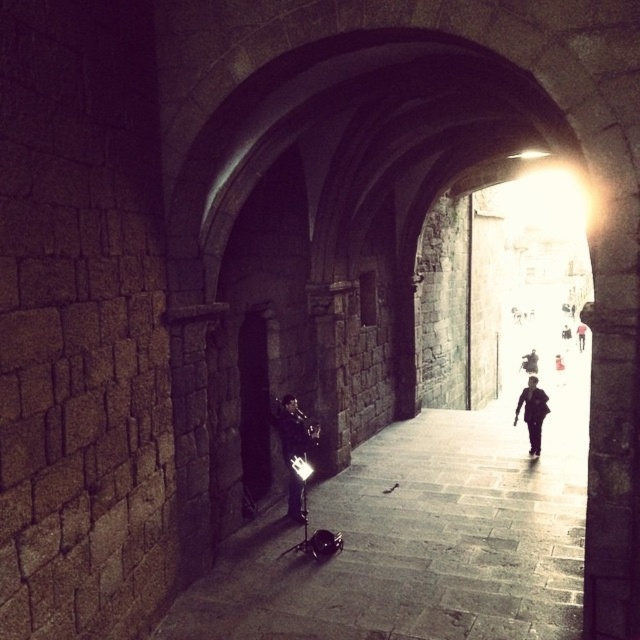
Based on the photo, you are a visitor in this archway and you see two jackets. The shiny black jacket at lower center and the black matte jacket at center. Which jacket is located to the left of the other?

The shiny black jacket at lower center is positioned on the left side of black matte jacket at center.

You are a delivery robot with a package that needs to be placed exactly between the shiny black jacket at lower center and the dark blue jeans at right. Given the distance between them, can you safely navigate and position the package in the middle without any obstacles?

The distance between the shiny black jacket at lower center and the dark blue jeans at right is 27.80 meters. Since the robot can navigate such a distance and there are no mentioned obstacles in the scene description, it should be possible to safely position the package in the middle.